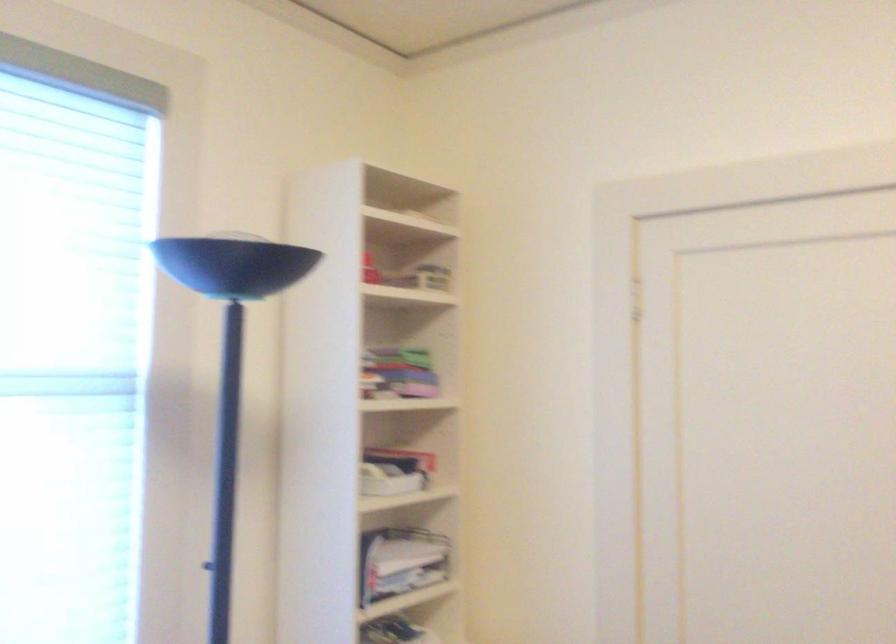
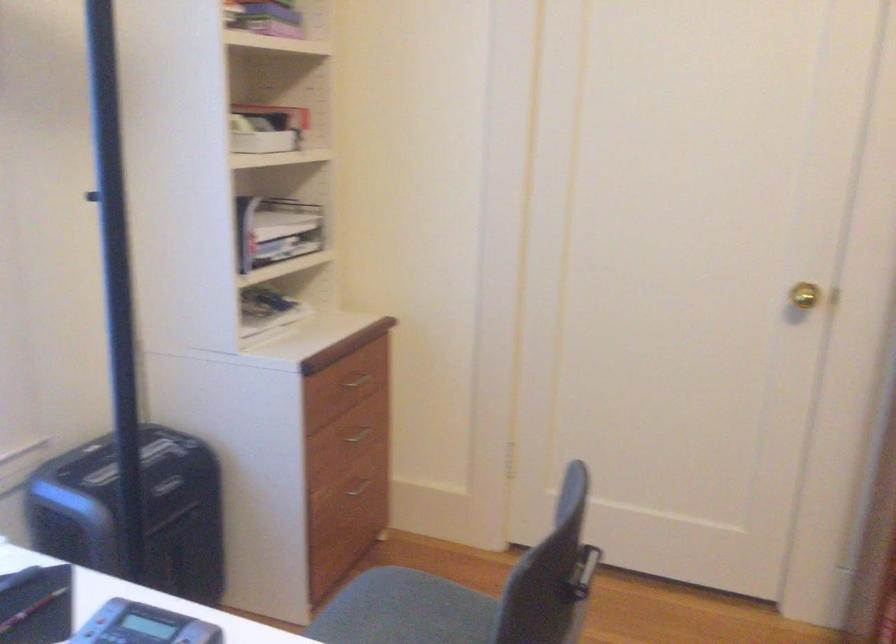
Question: The first image is from the beginning of the video and the second image is from the end. How did the camera likely rotate when shooting the video?

Choices:
 (A) Left
 (B) Right
 (C) Up
 (D) Down

Answer: (D)